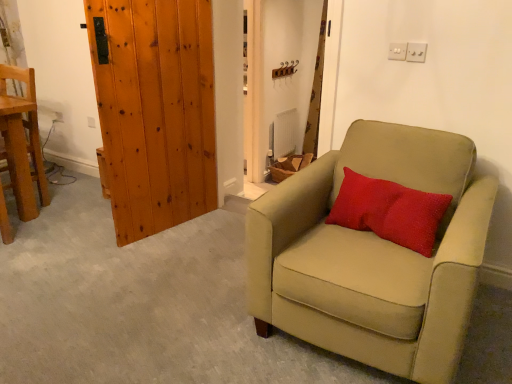
Where is `free spot to the left of suede beige armchair at right, which is the first chair in right-to-left order`? Image resolution: width=512 pixels, height=384 pixels. free spot to the left of suede beige armchair at right, which is the first chair in right-to-left order is located at coordinates (187, 301).